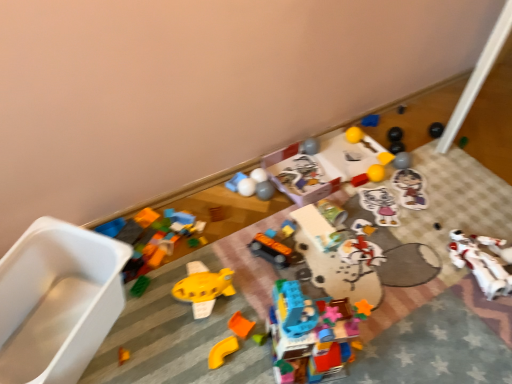
This screenshot has width=512, height=384. Find the location of `free space in front of white plastic robot at lower right, which appears as the seventeenth toy when viewed from the left`. free space in front of white plastic robot at lower right, which appears as the seventeenth toy when viewed from the left is located at coordinates (474, 321).